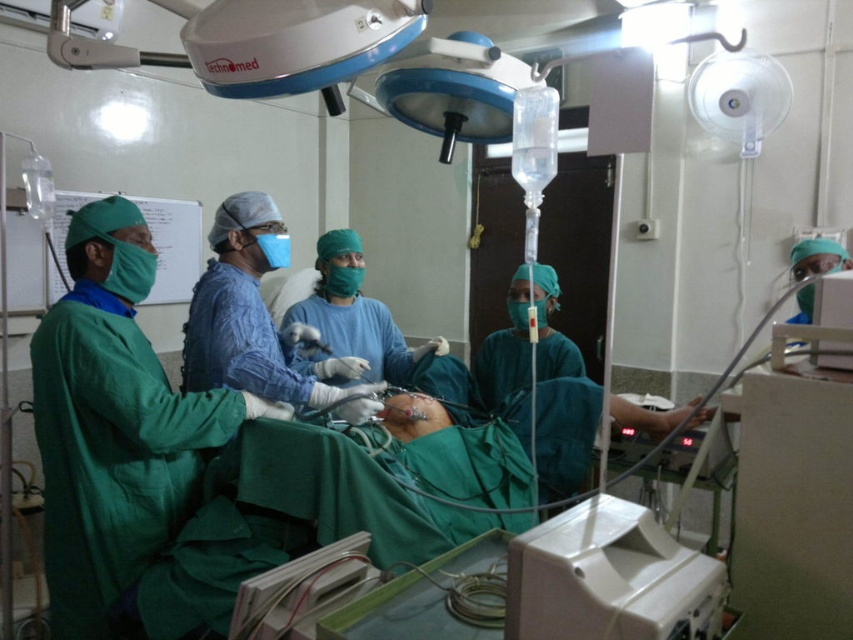
Is point (532, 561) farther from viewer compared to point (276, 605)?

That is False.

Where is `white plastic monitor at lower center`? Image resolution: width=853 pixels, height=640 pixels. white plastic monitor at lower center is located at coordinates (608, 579).

Measure the distance between white plastic monitor at lower center and camera.

white plastic monitor at lower center and camera are 80.10 centimeters apart from each other.

Between white plastic monitor at lower center and green matte surgical gown at center, which one is positioned lower?

white plastic monitor at lower center

Does point (523, 621) come in front of point (289, 364)?

Yes, point (523, 621) is closer to viewer.

You are a GUI agent. You are given a task and a screenshot of the screen. Output one action in this format:
    pyautogui.click(x=<x>, y=<y>)
    Task: Click on the white plastic monitor at lower center
    The image size is (853, 640).
    Given the screenshot: What is the action you would take?
    pyautogui.click(x=608, y=579)

Does green surgical gown at left have a greater height compared to green matte surgical gown at center?

Indeed, green surgical gown at left has a greater height compared to green matte surgical gown at center.

Is green surgical gown at left positioned before green matte surgical gown at center?

Yes.

Which is behind, point (74, 392) or point (225, 225)?

Point (225, 225)

Identify the location of green surgical gown at left. This screenshot has width=853, height=640. (115, 426).